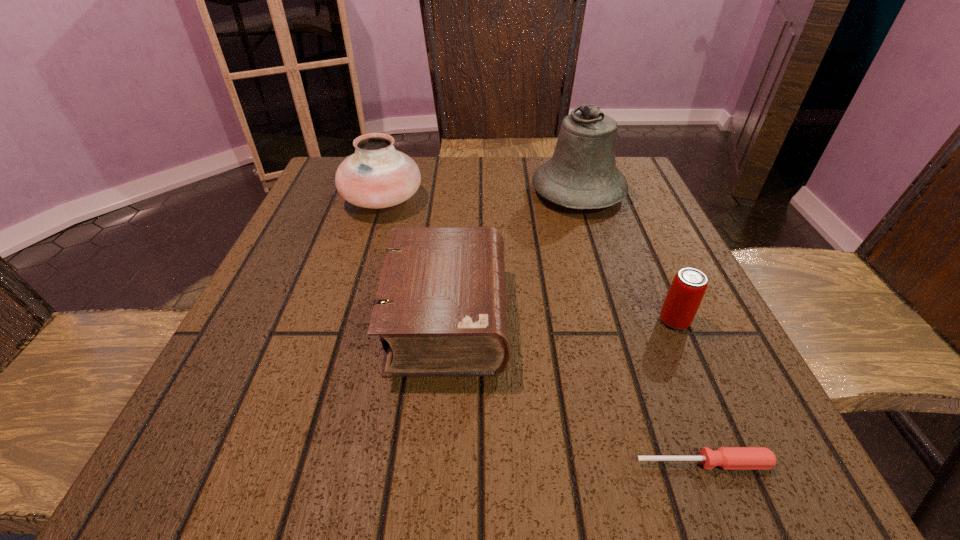
The height and width of the screenshot is (540, 960). I want to click on object at the near right corner, so click(x=728, y=458).

Image resolution: width=960 pixels, height=540 pixels. In order to click on vacant space at the far edge in this screenshot , I will do `click(433, 157)`.

In the image, there is a desktop. At what (x,y) coordinates should I click in order to perform the action: click on vacant space at the near edge. Please return your answer as a coordinate pair (x, y). The height and width of the screenshot is (540, 960). Looking at the image, I should click on (573, 434).

Locate an element on the screen. vacant point at the left edge is located at coordinates (316, 286).

This screenshot has width=960, height=540. Find the location of `vacant space at the right edge`. vacant space at the right edge is located at coordinates (637, 247).

The width and height of the screenshot is (960, 540). In the image, there is a desktop. Identify the location of vacant space at the far left corner. point(330,164).

Where is `vacant space at the near left corner of the desktop`? The image size is (960, 540). vacant space at the near left corner of the desktop is located at coordinates (259, 477).

In the image, there is a desktop. Where is `vacant space at the far right corner`? The height and width of the screenshot is (540, 960). vacant space at the far right corner is located at coordinates (635, 179).

Identify the location of vacant space at the near right corner of the desktop. The height and width of the screenshot is (540, 960). (662, 435).

Image resolution: width=960 pixels, height=540 pixels. I want to click on empty space that is in between the shortest object and the tallest object, so click(640, 328).